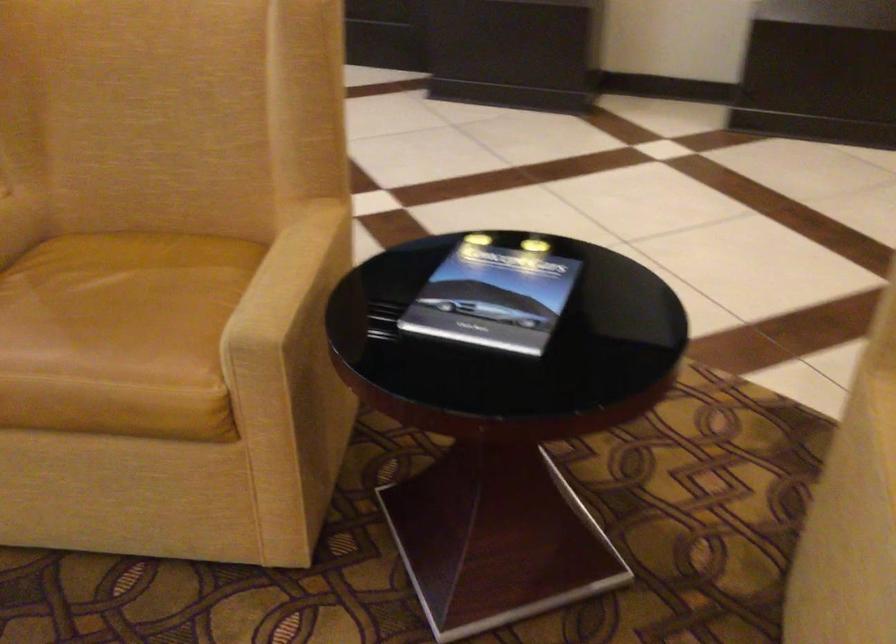
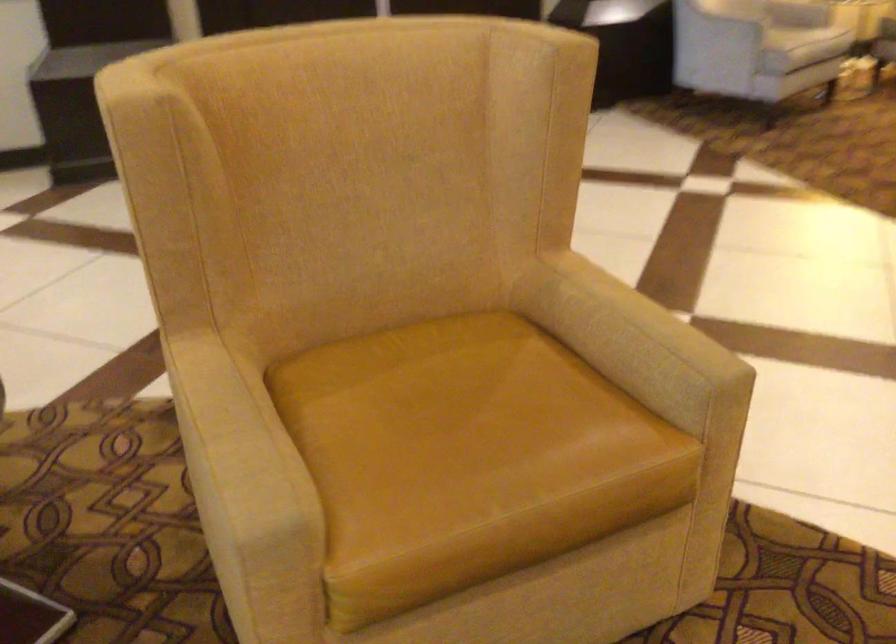
Question: The camera is either moving clockwise (left) or counter-clockwise (right) around the object. The first image is from the beginning of the video and the second image is from the end. Is the camera moving left or right when shooting the video?

Choices:
 (A) Left
 (B) Right

Answer: (A)